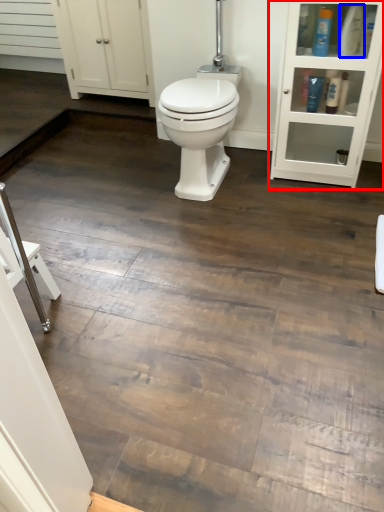
Question: Among these objects, which one is nearest to the camera, shelf (highlighted by a red box) or toiletry (highlighted by a blue box)?

Choices:
 (A) shelf
 (B) toiletry

Answer: (A)